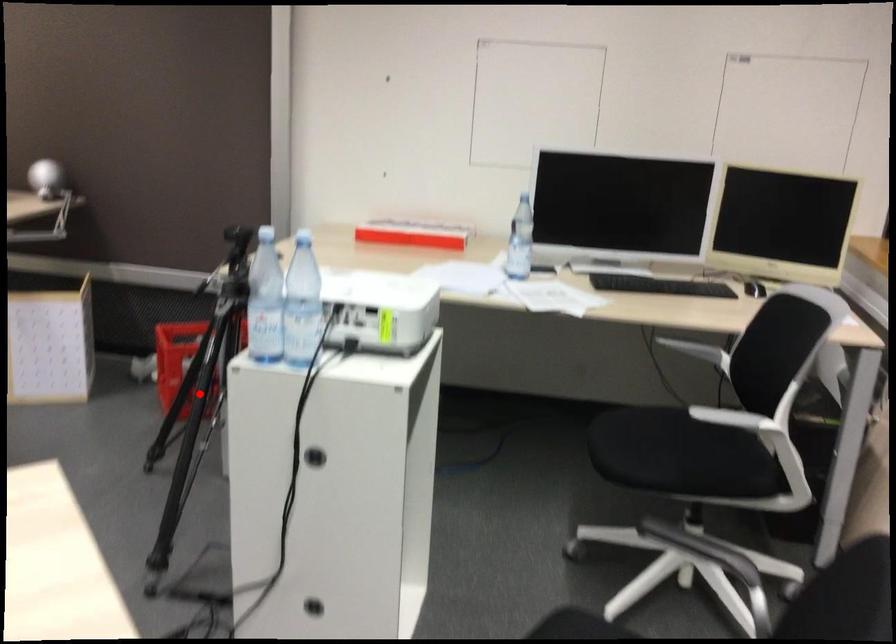
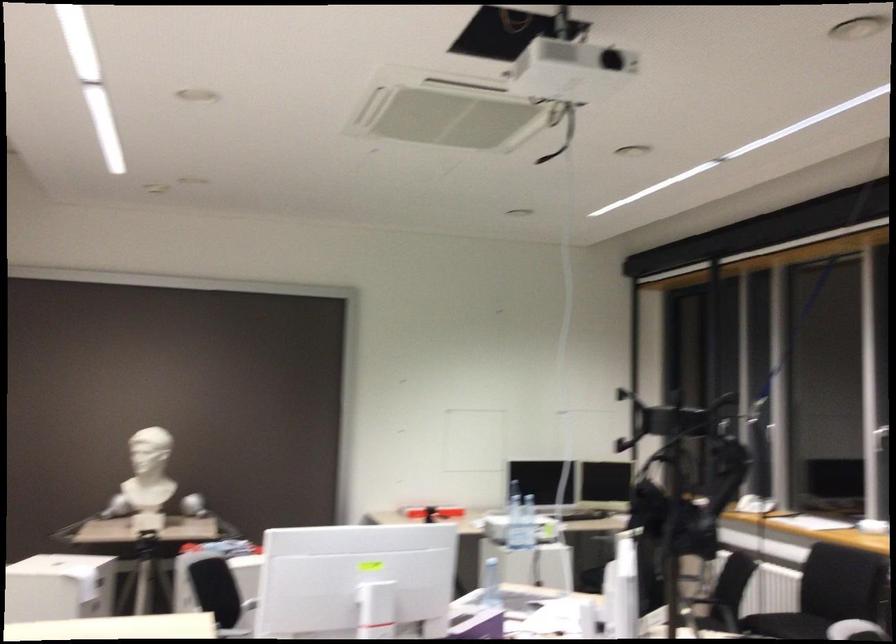
Question: I am providing you with two images of the same scene from different viewpoints. A red point is marked on the first image. Is the red point's position out of view in image 2?

Choices:
 (A) Yes
 (B) No

Answer: (A)